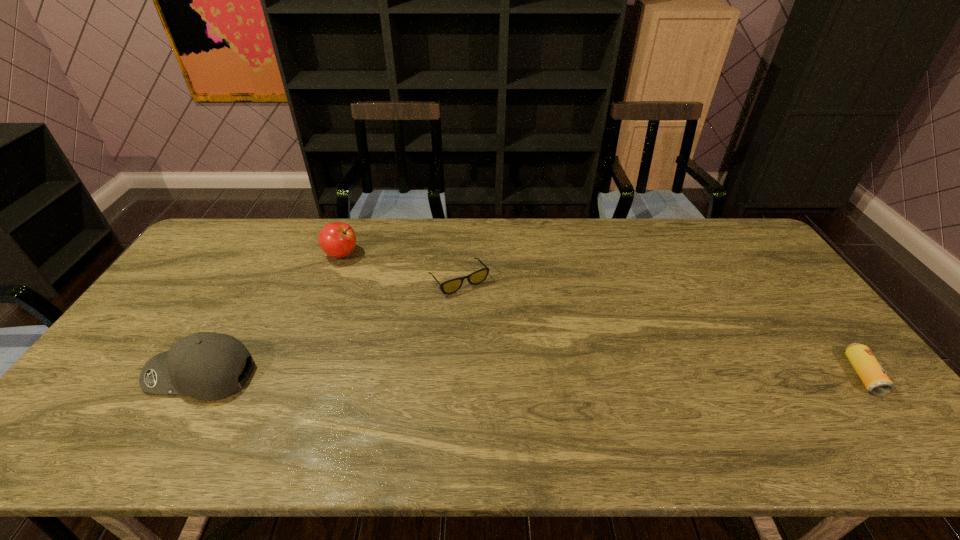
Locate an element on the screen. The width and height of the screenshot is (960, 540). free space located on the stem of the apple is located at coordinates (378, 300).

In order to click on free region located on the stem of the apple in this screenshot , I will do `click(398, 326)`.

Find the location of `object at the far edge`. object at the far edge is located at coordinates (336, 239).

Image resolution: width=960 pixels, height=540 pixels. In order to click on baseball cap situated at the near edge in this screenshot , I will do `click(205, 365)`.

In order to click on beer can at the near edge in this screenshot , I will do `click(871, 373)`.

The height and width of the screenshot is (540, 960). What are the coordinates of `object positioned at the left edge` in the screenshot? It's located at (205, 365).

Locate an element on the screen. object that is at the right edge is located at coordinates (871, 373).

The width and height of the screenshot is (960, 540). What are the coordinates of `object located in the near left corner section of the desktop` in the screenshot? It's located at (205, 365).

Identify the location of object at the near right corner. point(871,373).

Where is `vacant region at the far edge`? This screenshot has height=540, width=960. vacant region at the far edge is located at coordinates (433, 233).